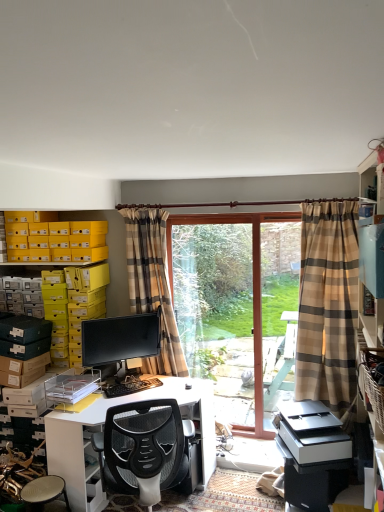
Question: Looking at their shapes, would you say clear glass screen door at center is wider or thinner than white glossy computer desk at center?

Choices:
 (A) wide
 (B) thin

Answer: (B)

Question: Looking at the image, does clear glass screen door at center seem bigger or smaller compared to white glossy computer desk at center?

Choices:
 (A) small
 (B) big

Answer: (A)

Question: Which of these objects is positioned closest to the yellow cardboard box at upper left?

Choices:
 (A) plaid fabric curtain at center, which ranks as the 2th curtain in front-to-back order
 (B) matte black monitor at center
 (C) clear glass door at center
 (D) white glossy computer desk at center
 (E) white plastic printer at center

Answer: (A)

Question: Considering the real-world distances, which object is closest to the plaid fabric curtain at center, acting as the 1th curtain starting from the back?

Choices:
 (A) plaid fabric curtain at right, acting as the first curtain starting from the right
 (B) black plastic keyboard at center
 (C) matte black monitor at center
 (D) yellow cardboard box at upper left
 (E) clear glass door at center

Answer: (C)